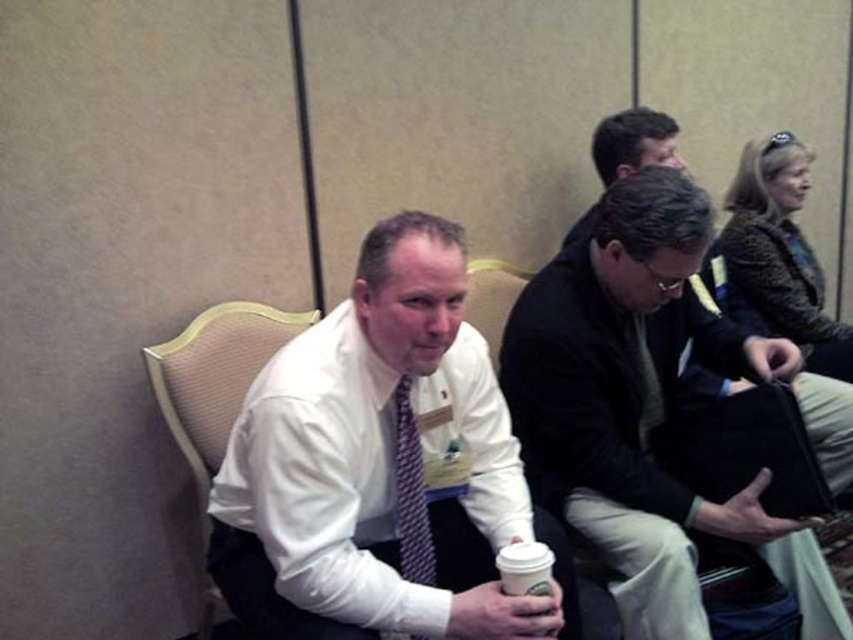
Is point (416, 528) farther from viewer compared to point (492, 316)?

No, it is in front of (492, 316).

Does striped fabric tie at center have a greater height compared to wooden chair at center?

Correct, striped fabric tie at center is much taller as wooden chair at center.

Image resolution: width=853 pixels, height=640 pixels. What do you see at coordinates (410, 493) in the screenshot?
I see `striped fabric tie at center` at bounding box center [410, 493].

At what (x,y) coordinates should I click in order to perform the action: click on striped fabric tie at center. Please return your answer as a coordinate pair (x, y). Looking at the image, I should click on (410, 493).

Between point (177, 422) and point (508, 582), which one is positioned in front?

Point (508, 582)

Who is more distant from viewer, (218, 618) or (515, 579)?

Point (218, 618)

Describe the element at coordinates (213, 378) in the screenshot. The image size is (853, 640). I see `beige fabric chair at left` at that location.

Locate an element on the screen. beige fabric chair at left is located at coordinates (213, 378).

Is point (653, 134) closer to viewer compared to point (405, 465)?

That is False.

Which is behind, point (686, 369) or point (419, 541)?

Positioned behind is point (686, 369).

Who is more forward, (822, 406) or (419, 541)?

Point (419, 541) is in front.

Locate an element on the screen. The image size is (853, 640). dark gray jacket at center is located at coordinates (692, 346).